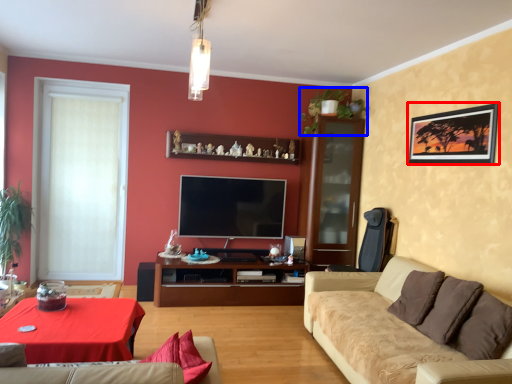
Question: Which point is closer to the camera, picture frame (highlighted by a red box) or plant (highlighted by a blue box)?

Choices:
 (A) picture frame
 (B) plant

Answer: (A)